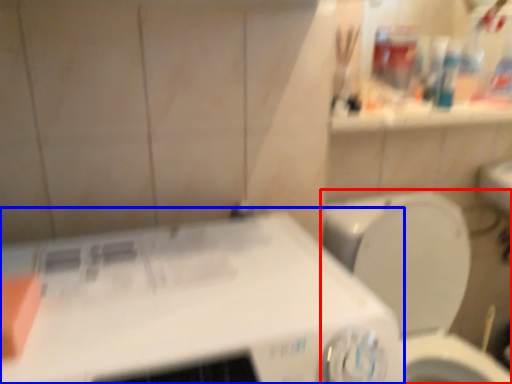
Question: Which point is further to the camera, toilet (highlighted by a red box) or appliance (highlighted by a blue box)?

Choices:
 (A) toilet
 (B) appliance

Answer: (A)